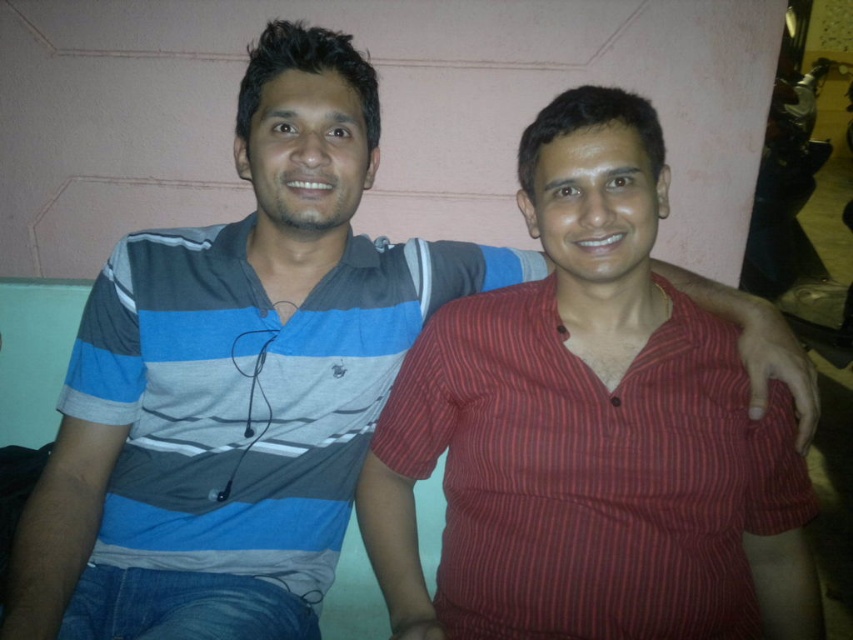
Between red striped shirt at center and striped cotton shirt at left, which one has less height?

With less height is red striped shirt at center.

Can you confirm if red striped shirt at center is thinner than striped cotton shirt at left?

Indeed, red striped shirt at center has a lesser width compared to striped cotton shirt at left.

What do you see at coordinates (590, 474) in the screenshot? This screenshot has height=640, width=853. I see `red striped shirt at center` at bounding box center [590, 474].

Identify the location of red striped shirt at center. (590, 474).